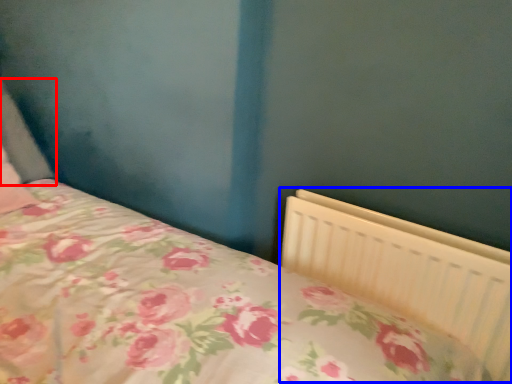
Question: Which point is closer to the camera, pillow (highlighted by a red box) or radiator (highlighted by a blue box)?

Choices:
 (A) pillow
 (B) radiator

Answer: (B)